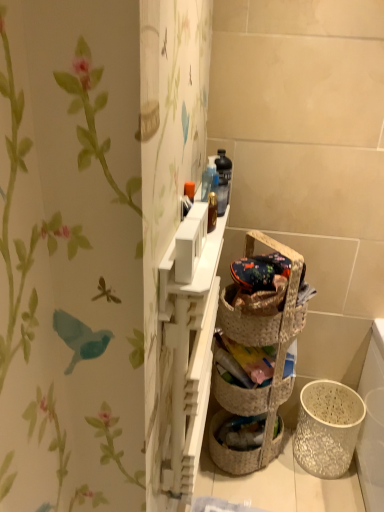
Locate an element on the screen. The height and width of the screenshot is (512, 384). empty space that is ontop of woven brown picnic basket at center is located at coordinates (275, 273).